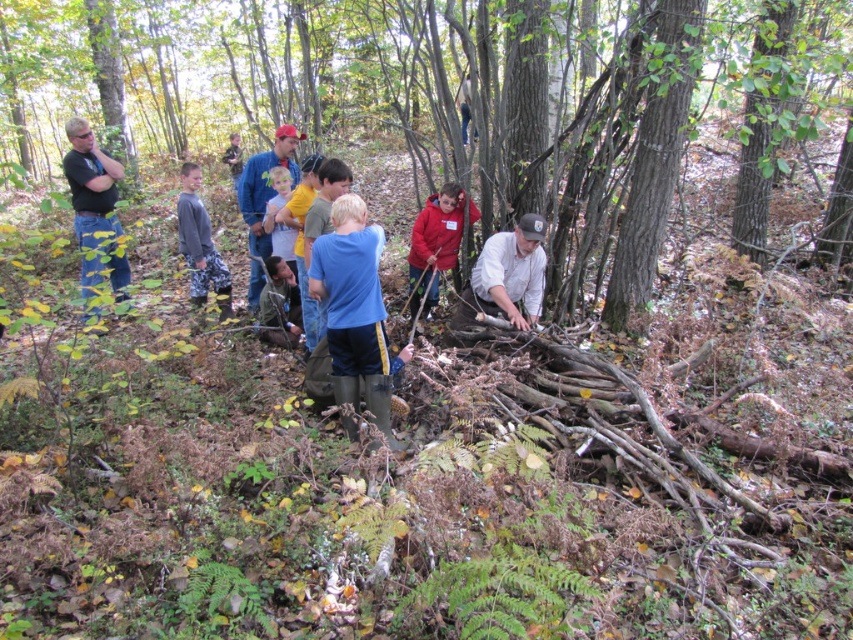
Which is more to the left, blue shirt at center or green fabric shirt at center?

blue shirt at center

Between blue shirt at center and green fabric shirt at center, which one appears on the right side from the viewer's perspective?

green fabric shirt at center

Find the location of a particular element. blue shirt at center is located at coordinates [x=265, y=186].

Is green fabric shirt at center behind blue denim jeans at upper center?

No, green fabric shirt at center is in front of blue denim jeans at upper center.

Describe the element at coordinates (279, 305) in the screenshot. The width and height of the screenshot is (853, 640). I see `green fabric shirt at center` at that location.

Is point (280, 332) positioned before point (463, 112)?

Yes, point (280, 332) is closer to viewer.

Find the location of a particular element. The image size is (853, 640). green fabric shirt at center is located at coordinates (279, 305).

Which is behind, point (338, 330) or point (234, 186)?

The point (234, 186) is more distant.

Where is `blue rubber boots at center`? blue rubber boots at center is located at coordinates point(354,310).